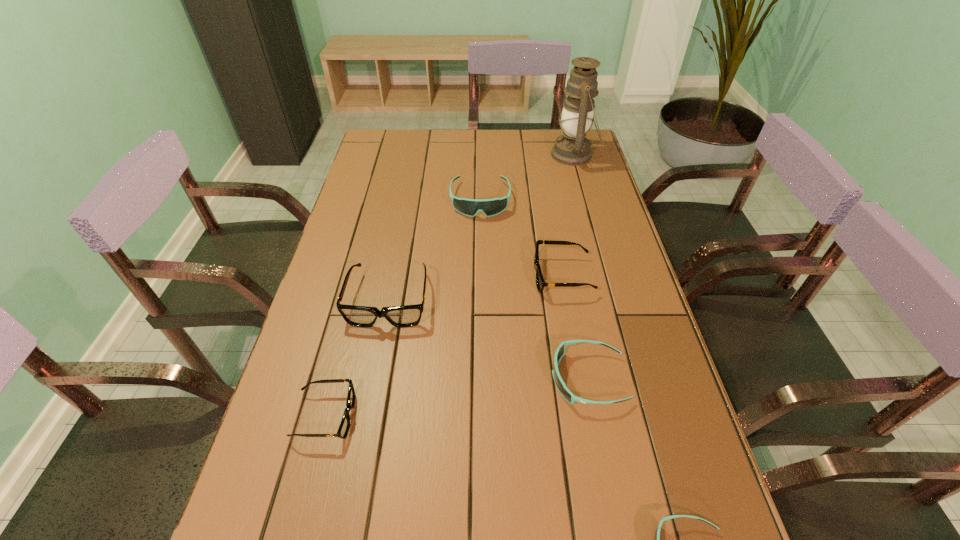
Where is `object that is at the far right corner`? The image size is (960, 540). object that is at the far right corner is located at coordinates (572, 148).

Locate an element on the screen. The image size is (960, 540). vacant area at the far edge of the desktop is located at coordinates (491, 147).

What are the coordinates of `free region at the left edge of the desktop` in the screenshot? It's located at (390, 248).

Locate an element on the screen. vacant region at the right edge of the desktop is located at coordinates (597, 270).

Image resolution: width=960 pixels, height=540 pixels. In order to click on vacant space at the far left corner of the desktop in this screenshot , I will do `click(398, 158)`.

In the image, there is a desktop. What are the coordinates of `free region at the far right corner` in the screenshot? It's located at (554, 134).

This screenshot has width=960, height=540. What are the coordinates of `free spot between the oil lamp and the rightmost black sunglasses` in the screenshot? It's located at (567, 215).

This screenshot has width=960, height=540. Find the location of `blank region between the nearest black sunglasses and the tallest object`. blank region between the nearest black sunglasses and the tallest object is located at coordinates (449, 286).

Locate an element on the screen. This screenshot has height=540, width=960. free space that is in between the smallest black sunglasses and the tallest object is located at coordinates (449, 286).

Find the location of `vacant space in between the second smallest black sunglasses and the third sunglasses from left to right`. vacant space in between the second smallest black sunglasses and the third sunglasses from left to right is located at coordinates (521, 238).